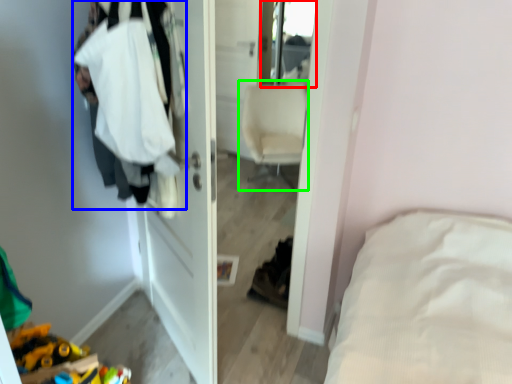
Question: Which object is positioned closest to mirror (highlighted by a red box)? Select from clothing (highlighted by a blue box) and chair (highlighted by a green box).

Choices:
 (A) clothing
 (B) chair

Answer: (B)